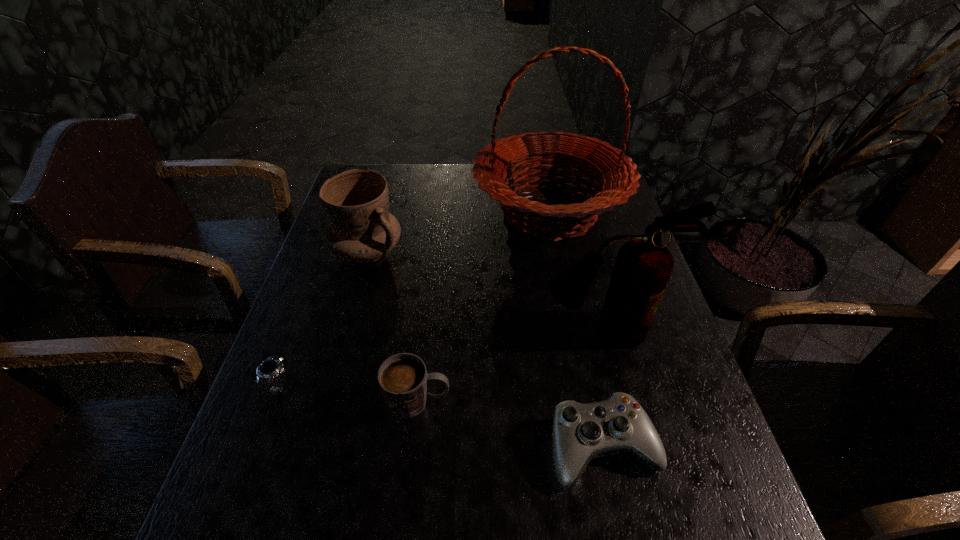
This screenshot has width=960, height=540. I want to click on object that is at the far right corner, so click(616, 174).

Where is `vacant space at the far edge`? This screenshot has width=960, height=540. vacant space at the far edge is located at coordinates (424, 193).

In the image, there is a desktop. Where is `vacant space at the near edge`? The image size is (960, 540). vacant space at the near edge is located at coordinates (479, 516).

The image size is (960, 540). In the image, there is a desktop. What are the coordinates of `free region at the left edge` in the screenshot? It's located at (286, 477).

Find the location of a particular element. free space at the right edge is located at coordinates (728, 487).

The height and width of the screenshot is (540, 960). Find the location of `vacant space at the far left corner of the desktop`. vacant space at the far left corner of the desktop is located at coordinates (363, 166).

The height and width of the screenshot is (540, 960). I want to click on free area in between the control and the tallest object, so click(x=576, y=330).

Identify the location of free space between the tallest object and the second shortest object. (576, 330).

Locate an element on the screen. The image size is (960, 540). vacant area that lies between the second tallest object and the fourth object from right to left is located at coordinates (511, 366).

This screenshot has height=540, width=960. In order to click on free space between the fourth tallest object and the third tallest object in this screenshot , I will do `click(393, 327)`.